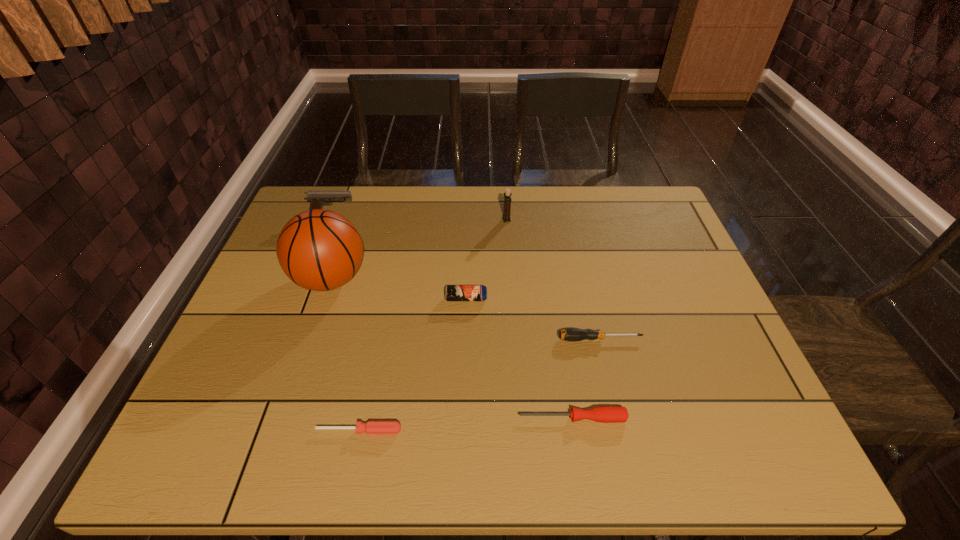
Where is `basketball`? This screenshot has height=540, width=960. basketball is located at coordinates (320, 250).

Where is `the second tallest object`? The width and height of the screenshot is (960, 540). the second tallest object is located at coordinates (507, 195).

Locate an element on the screen. The image size is (960, 540). the third tallest object is located at coordinates (316, 198).

I want to click on the fourth object from left to right, so click(452, 292).

This screenshot has width=960, height=540. I want to click on the fourth shortest object, so click(452, 292).

Where is `the fifth tallest object`? the fifth tallest object is located at coordinates pos(572,334).

This screenshot has width=960, height=540. Find the location of `the tallest screwdriver`. the tallest screwdriver is located at coordinates (572, 334).

Find the location of a particular element. The height and width of the screenshot is (540, 960). the sixth farthest object is located at coordinates (605, 414).

Image resolution: width=960 pixels, height=540 pixels. I want to click on the nearest screwdriver, so click(371, 427).

Find the location of a particular element. the nearest object is located at coordinates (371, 427).